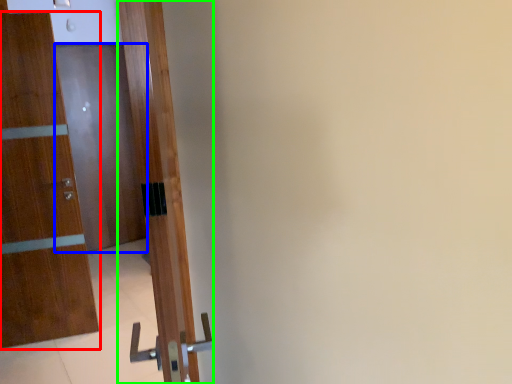
Question: Which is nearer to the door (highlighted by a red box)? door (highlighted by a blue box) or door (highlighted by a green box).

Choices:
 (A) door
 (B) door

Answer: (B)